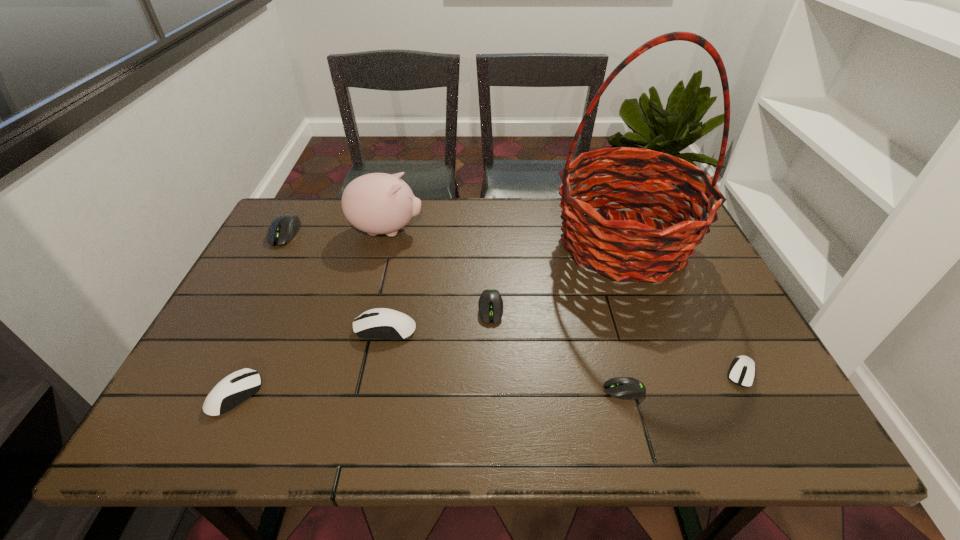
This screenshot has width=960, height=540. In order to click on object present at the near left corner in this screenshot , I will do `click(235, 388)`.

The height and width of the screenshot is (540, 960). Identify the location of object at the far right corner. (654, 251).

Locate an element on the screen. Image resolution: width=960 pixels, height=540 pixels. vacant space at the far edge of the desktop is located at coordinates (480, 222).

Where is `free space at the near edge`? free space at the near edge is located at coordinates [x=346, y=415].

Locate an element on the screen. vacant region at the left edge of the desktop is located at coordinates (253, 272).

You are a GUI agent. You are given a task and a screenshot of the screen. Output one action in this format:
    pyautogui.click(x=<x>, y=<y>)
    Task: Click on the vacant point at the far left corner
    
    Given the screenshot: What is the action you would take?
    pyautogui.click(x=329, y=214)

You are a GUI agent. You are given a task and a screenshot of the screen. Output one action in this format:
    pyautogui.click(x=<x>, y=<y>)
    Task: Click on the free region at the near right corner
    The width and height of the screenshot is (960, 540).
    Given the screenshot: What is the action you would take?
    pyautogui.click(x=776, y=446)

This screenshot has width=960, height=540. What are the coordinates of `free area in between the shortest object and the second biggest white mouse` in the screenshot? It's located at (430, 393).

Find the location of a particular element. The height and width of the screenshot is (540, 960). vacant space that's between the farthest white mouse and the leftmost gray computer mouse is located at coordinates tap(335, 281).

Locate an element on the screen. Image resolution: width=960 pixels, height=540 pixels. free space between the second smallest white mouse and the tallest object is located at coordinates (429, 319).